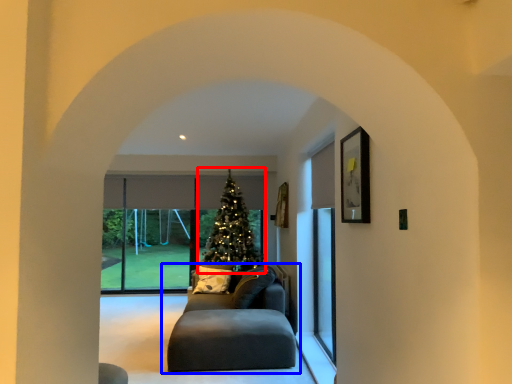
Question: Which object appears farthest to the camera in this image, christmas tree (highlighted by a red box) or studio couch (highlighted by a blue box)?

Choices:
 (A) christmas tree
 (B) studio couch

Answer: (A)